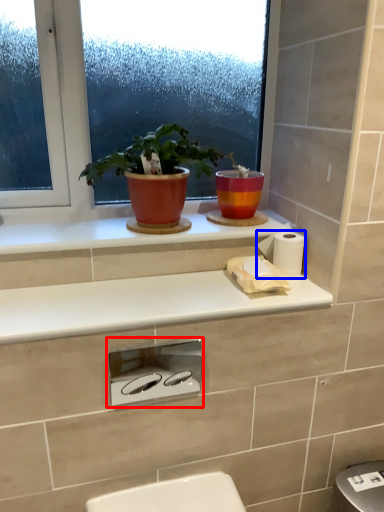
Question: Which object appears closest to the camera in this image, appliance (highlighted by a red box) or toilet paper (highlighted by a blue box)?

Choices:
 (A) appliance
 (B) toilet paper

Answer: (A)